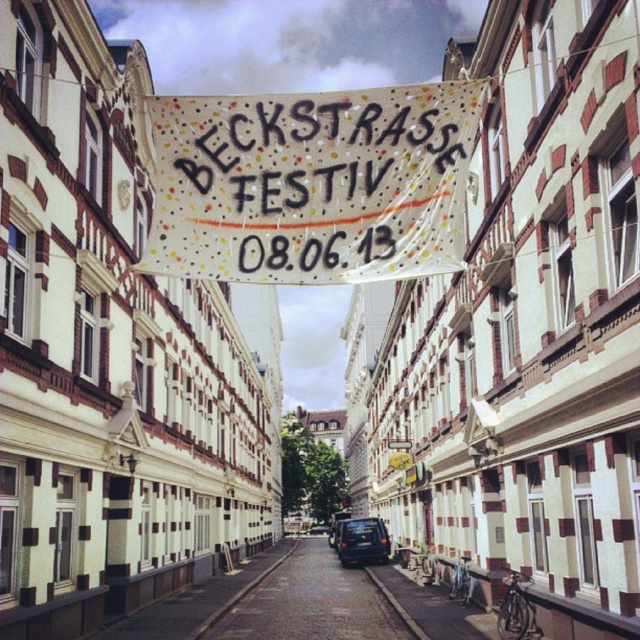
Describe the element at coordinates (310, 184) in the screenshot. This screenshot has width=640, height=640. I see `white fabric banner at center` at that location.

Measure the distance between point (x=388, y=195) and camera.

Point (x=388, y=195) is 70.40 meters away from camera.

You are a GUI agent. You are given a task and a screenshot of the screen. Output one action in this format:
    pyautogui.click(x=<x>, y=<y>)
    Task: Click on the white fabric banner at center
    Image resolution: width=640 pixels, height=640 pixels.
    Given the screenshot: What is the action you would take?
    pyautogui.click(x=310, y=184)

Between white fabric banner at center and dark blue matte van at center, which one appears on the right side from the viewer's perspective?

Positioned to the right is dark blue matte van at center.

You are a GUI agent. You are given a task and a screenshot of the screen. Output one action in this format:
    pyautogui.click(x=<x>, y=<y>)
    Task: Click on the white fabric banner at center
    This screenshot has width=640, height=640.
    Given the screenshot: What is the action you would take?
    pyautogui.click(x=310, y=184)

In order to click on white fabric banner at center in this screenshot , I will do `click(310, 184)`.

Is dark gray asphalt at center further to the viewer compared to dark blue matte van at center?

No, dark gray asphalt at center is in front of dark blue matte van at center.

How much distance is there between dark gray asphalt at center and dark blue matte van at center?

The distance of dark gray asphalt at center from dark blue matte van at center is 59.65 feet.

Locate an element on the screen. The image size is (640, 640). dark gray asphalt at center is located at coordinates (308, 602).